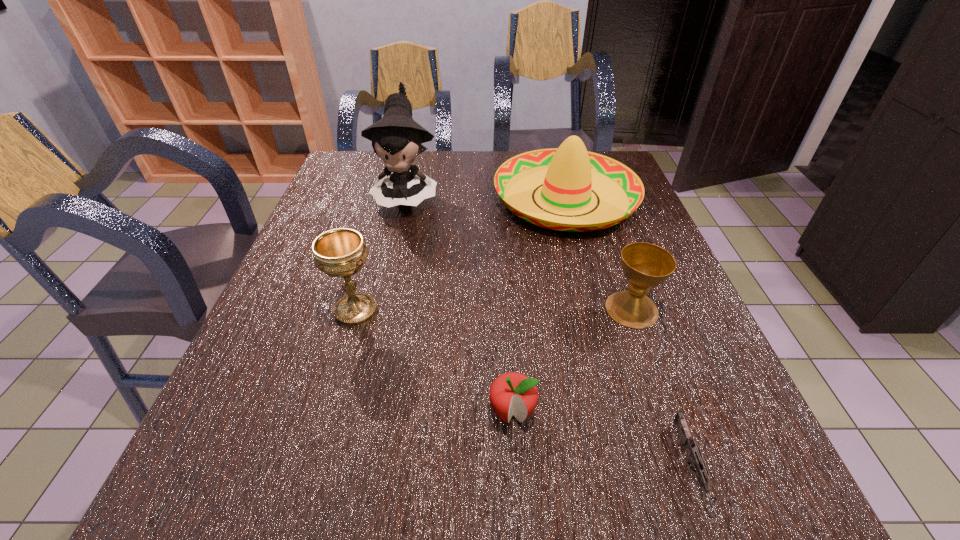
Identify the location of blank space that satisfies the following two spatial constraints: 1. at the face of the tallest object; 2. on the left side of the third shortest object. (380, 309).

Identify the location of vacant region that satisfies the following two spatial constraints: 1. at the face of the doll; 2. on the right side of the sombrero. (406, 198).

You are a GUI agent. You are given a task and a screenshot of the screen. Output one action in this format:
    pyautogui.click(x=<x>, y=<y>)
    Task: Click on the free location that satisfies the following two spatial constraints: 1. at the face of the sombrero; 2. on the right side of the doll
    This screenshot has width=960, height=540.
    Given the screenshot: What is the action you would take?
    pyautogui.click(x=406, y=198)

Where is `free spot that satisfies the following two spatial constraints: 1. at the face of the tallest object; 2. on the left side of the sombrero`? The width and height of the screenshot is (960, 540). free spot that satisfies the following two spatial constraints: 1. at the face of the tallest object; 2. on the left side of the sombrero is located at coordinates (406, 198).

You are a GUI agent. You are given a task and a screenshot of the screen. Output one action in this format:
    pyautogui.click(x=<x>, y=<y>)
    Task: Click on the vacant space that satisfies the following two spatial constraints: 1. at the face of the tallest object; 2. on the right side of the shorter chalice
    The image size is (960, 540).
    Given the screenshot: What is the action you would take?
    coord(380,309)